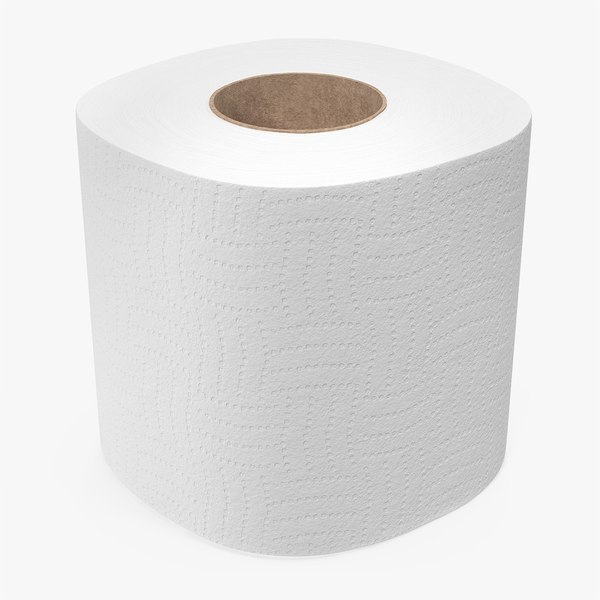
The height and width of the screenshot is (600, 600). Find the location of `left upper edge of toilet paper`. left upper edge of toilet paper is located at coordinates (76, 118).